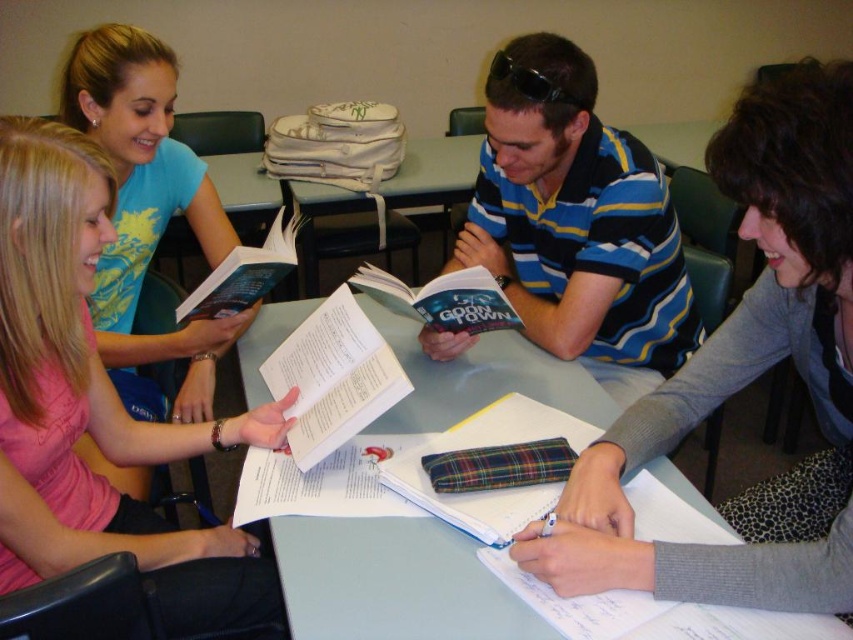
Is plaid fabric notebook at center taller than hardcover book at center?

Correct, plaid fabric notebook at center is much taller as hardcover book at center.

Between point (450, 497) and point (396, 300), which one is positioned behind?

The point (396, 300) is behind.

This screenshot has width=853, height=640. Identify the location of plaid fabric notebook at center. (483, 445).

Is white paper book at center below hardcover book at upper left?

Yes.

Is white paper book at center closer to the viewer compared to hardcover book at upper left?

Yes, white paper book at center is closer to the viewer.

Find the location of `white paper book at center`. white paper book at center is located at coordinates (334, 378).

Between point (836, 156) and point (48, 385), which one is positioned behind?

Positioned behind is point (48, 385).

Can you confirm if gray sweater at center is positioned above pink fabric shirt at upper left?

Correct, gray sweater at center is located above pink fabric shirt at upper left.

Who is more forward, (848, 236) or (102, 444)?

Point (848, 236) is more forward.

Find the location of a particular element. This screenshot has height=640, width=853. gray sweater at center is located at coordinates (746, 380).